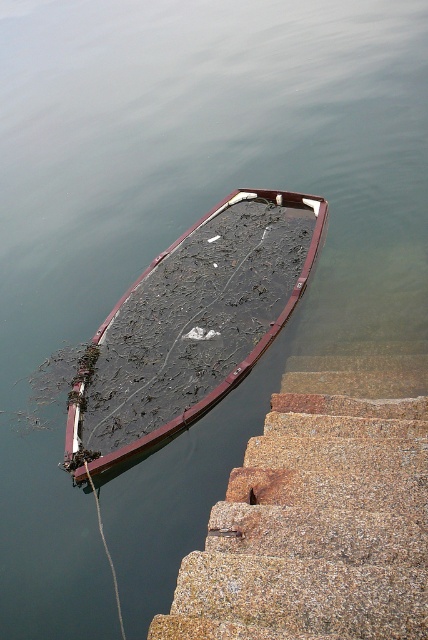
You are a swimmer wanting to enter the water. You see the granite steps at lower right and the rusty metal boat at lower left. Which one is shorter in height?

The granite steps at lower right has a lesser height compared to the rusty metal boat at lower left, so the granite steps at lower right is shorter in height.

You are standing on the granite steps at lower right and want to reach the rusty metal boat at lower left. Can you step directly onto the boat from the steps?

The granite steps at lower right is positioned under the rusty metal boat at lower left, so yes, you can step directly onto the boat from the steps because the boat is located above the steps.